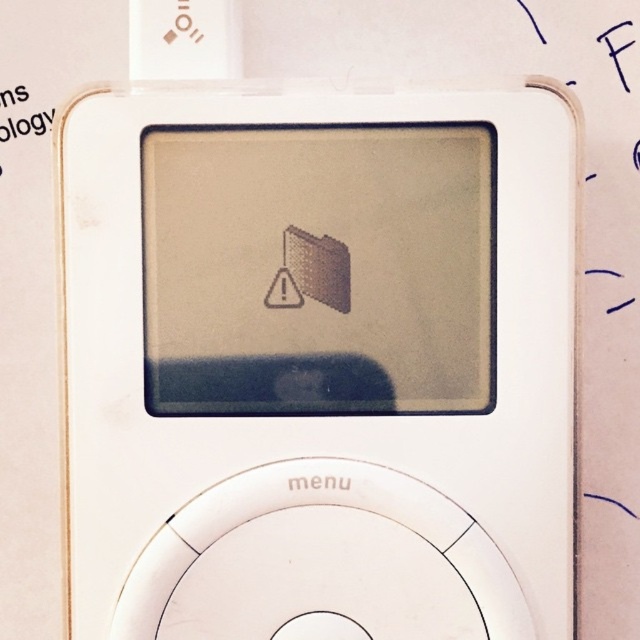
You are holding a white plastic ipod at center and want to place it on top of a black paper at upper left. Considering their sizes, will the ipod cover the entire paper?

The white plastic ipod at center is larger in size than black paper at upper left, so placing it on top would cover the entire paper.

You are holding an older model iPod and want to reach the point at coordinates point (268, 161) on its screen. If your finger is 2.5 inches wide, can you touch that point without your finger covering the folder icon with an exclamation mark? Explain your reasoning.

The point (268, 161) is 32.96 inches from the camera. Since your finger is only 2.5 inches wide, the distance is much greater than the finger width. Therefore, you can touch the point without covering the folder icon.

You are holding an older model iPod and want to check the distance between two points on the screen to ensure your stylus can reach both. The points are labeled as point (x=262, y=403) and point (x=38, y=113). Given that your stylus can only reach up to 0.5 units, will it be able to reach both points comfortably?

The distance between point (x=262, y=403) and point (x=38, y=113) is not provided in the description. However, the Objects Description states that point (x=262, y=403) is closer to the camera than point (x=38, y=113). This does not directly indicate the distance between them, so we cannot confirm if the stylus can reach both points based on the given information.